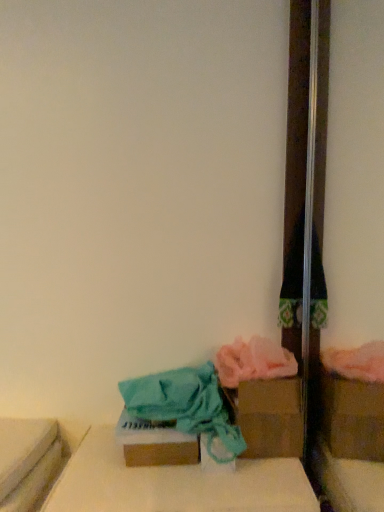
Locate an element on the screen. brown cardboard box at lower center, placed as the first storage box when sorted from front to back is located at coordinates (155, 443).

Find the location of a particular element. brown cardboard box at lower right, the first storage box positioned from the back is located at coordinates (268, 417).

How many degrees apart are the facing directions of brown cardboard box at lower right, which appears as the first storage box when viewed from the right, and brown cardboard box at lower center, placed as the first storage box when sorted from front to back?

There is a 0.8-degree angle between the facing directions of brown cardboard box at lower right, which appears as the first storage box when viewed from the right, and brown cardboard box at lower center, placed as the first storage box when sorted from front to back.

From the image's perspective, is brown cardboard box at lower right, the second storage box positioned from the left, above or below brown cardboard box at lower center, the 2th storage box when ordered from back to front?

From the image's perspective, brown cardboard box at lower right, the second storage box positioned from the left, appears above brown cardboard box at lower center, the 2th storage box when ordered from back to front.

Does brown cardboard box at lower right, the second storage box positioned from the front, turn towards brown cardboard box at lower center, acting as the 2th storage box starting from the right?

No, brown cardboard box at lower right, the second storage box positioned from the front, is not facing towards brown cardboard box at lower center, acting as the 2th storage box starting from the right.

Consider the image. From a real-world perspective, is brown cardboard box at lower right, the second storage box positioned from the left, physically above brown cardboard box at lower center, the first storage box from the left?

Yes, from a real-world perspective, brown cardboard box at lower right, the second storage box positioned from the left, is above brown cardboard box at lower center, the first storage box from the left.

In the scene shown: Considering the relative sizes of cardboard box at lower center and brown cardboard box at lower center, the first storage box from the left, in the image provided, is cardboard box at lower center thinner than brown cardboard box at lower center, the first storage box from the left,?

In fact, cardboard box at lower center might be wider than brown cardboard box at lower center, the first storage box from the left.

From a real-world perspective, does cardboard box at lower center sit lower than brown cardboard box at lower center, placed as the first storage box when sorted from front to back?

Indeed, from a real-world perspective, cardboard box at lower center is positioned beneath brown cardboard box at lower center, placed as the first storage box when sorted from front to back.

The image size is (384, 512). I want to click on furniture lying below the brown cardboard box at lower center, acting as the 2th storage box starting from the right (from the image's perspective), so (175, 484).

Could you tell me if brown cardboard box at lower center, the first storage box from the left, is turned towards cardboard box at lower center?

No, brown cardboard box at lower center, the first storage box from the left, is not aimed at cardboard box at lower center.

Relative to cardboard box at lower center, is brown cardboard box at lower center, placed as the first storage box when sorted from front to back, in front or behind?

brown cardboard box at lower center, placed as the first storage box when sorted from front to back, is behind cardboard box at lower center.

Is brown cardboard box at lower center, placed as the first storage box when sorted from front to back, spatially inside cardboard box at lower center, or outside of it?

brown cardboard box at lower center, placed as the first storage box when sorted from front to back, is located beyond the bounds of cardboard box at lower center.

Considering the relative sizes of brown cardboard box at lower center, the 2th storage box when ordered from back to front, and cardboard box at lower center in the image provided, is brown cardboard box at lower center, the 2th storage box when ordered from back to front, shorter than cardboard box at lower center?

No.

Is brown cardboard box at lower right, which appears as the first storage box when viewed from the right, located outside cardboard box at lower center?

brown cardboard box at lower right, which appears as the first storage box when viewed from the right, is positioned outside cardboard box at lower center.

Considering the sizes of objects brown cardboard box at lower right, the first storage box positioned from the back, and cardboard box at lower center in the image provided, who is taller, brown cardboard box at lower right, the first storage box positioned from the back, or cardboard box at lower center?

brown cardboard box at lower right, the first storage box positioned from the back.

Is brown cardboard box at lower right, which appears as the first storage box when viewed from the right, thinner than cardboard box at lower center?

Yes.

In the image, is cardboard box at lower center positioned in front of or behind brown cardboard box at lower right, which appears as the first storage box when viewed from the right?

Clearly, cardboard box at lower center is in front of brown cardboard box at lower right, which appears as the first storage box when viewed from the right.

What are the coordinates of `furniture in front of the brown cardboard box at lower right, which appears as the first storage box when viewed from the right` in the screenshot? It's located at (175, 484).

Does point (111, 452) lie in front of point (268, 440)?

No, it is not.

Based on the photo, from a real-world perspective, which is physically above, cardboard box at lower center or brown cardboard box at lower right, the second storage box positioned from the left?

brown cardboard box at lower right, the second storage box positioned from the left, is physically above.

Locate an element on the screen. storage box that appears above the brown cardboard box at lower center, the first storage box from the left (from a real-world perspective) is located at coordinates (268, 417).

Is brown cardboard box at lower center, the 2th storage box when ordered from back to front, closer to camera compared to brown cardboard box at lower right, which appears as the first storage box when viewed from the right?

Yes.

From a real-world perspective, is brown cardboard box at lower center, placed as the first storage box when sorted from front to back, positioned over brown cardboard box at lower right, the second storage box positioned from the front, based on gravity?

Actually, brown cardboard box at lower center, placed as the first storage box when sorted from front to back, is physically below brown cardboard box at lower right, the second storage box positioned from the front, in the real world.

In the scene shown: Considering the sizes of objects brown cardboard box at lower center, the 2th storage box when ordered from back to front, and brown cardboard box at lower right, the second storage box positioned from the front, in the image provided, who is bigger, brown cardboard box at lower center, the 2th storage box when ordered from back to front, or brown cardboard box at lower right, the second storage box positioned from the front,?

Bigger between the two is brown cardboard box at lower right, the second storage box positioned from the front.

The width and height of the screenshot is (384, 512). I want to click on storage box located on the right of brown cardboard box at lower center, the first storage box from the left, so click(268, 417).

Locate an element on the screen. The width and height of the screenshot is (384, 512). furniture beneath the brown cardboard box at lower center, acting as the 2th storage box starting from the right (from a real-world perspective) is located at coordinates (175, 484).

Estimate the real-world distances between objects in this image. Which object is further from brown cardboard box at lower center, placed as the first storage box when sorted from front to back, cardboard box at lower center or brown cardboard box at lower right, the second storage box positioned from the front?

The object further to brown cardboard box at lower center, placed as the first storage box when sorted from front to back, is brown cardboard box at lower right, the second storage box positioned from the front.

From the image, which object appears to be nearer to cardboard box at lower center, brown cardboard box at lower right, the first storage box positioned from the back, or brown cardboard box at lower center, placed as the first storage box when sorted from front to back?

brown cardboard box at lower center, placed as the first storage box when sorted from front to back, is positioned closer to the anchor cardboard box at lower center.

From the image, which object appears to be nearer to brown cardboard box at lower right, the second storage box positioned from the left, cardboard box at lower center or brown cardboard box at lower center, the 2th storage box when ordered from back to front?

cardboard box at lower center.

Based on their spatial positions, is brown cardboard box at lower center, the first storage box from the left, or cardboard box at lower center closer to brown cardboard box at lower right, which appears as the first storage box when viewed from the right?

Based on the image, cardboard box at lower center appears to be nearer to brown cardboard box at lower right, which appears as the first storage box when viewed from the right.

Based on the photo, based on their spatial positions, is brown cardboard box at lower right, which appears as the first storage box when viewed from the right, or cardboard box at lower center further from brown cardboard box at lower center, placed as the first storage box when sorted from front to back?

Among the two, brown cardboard box at lower right, which appears as the first storage box when viewed from the right, is located further to brown cardboard box at lower center, placed as the first storage box when sorted from front to back.

Looking at the image, which one is located further to cardboard box at lower center, brown cardboard box at lower center, the first storage box from the left, or brown cardboard box at lower right, the first storage box positioned from the back?

Among the two, brown cardboard box at lower right, the first storage box positioned from the back, is located further to cardboard box at lower center.

I want to click on furniture situated between brown cardboard box at lower center, placed as the first storage box when sorted from front to back, and brown cardboard box at lower right, the second storage box positioned from the left, from left to right, so click(175, 484).